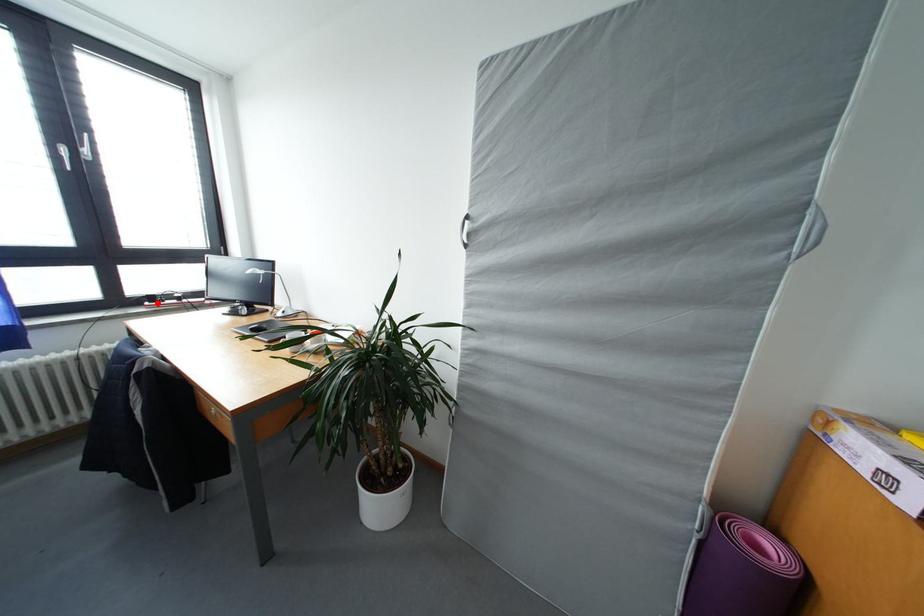
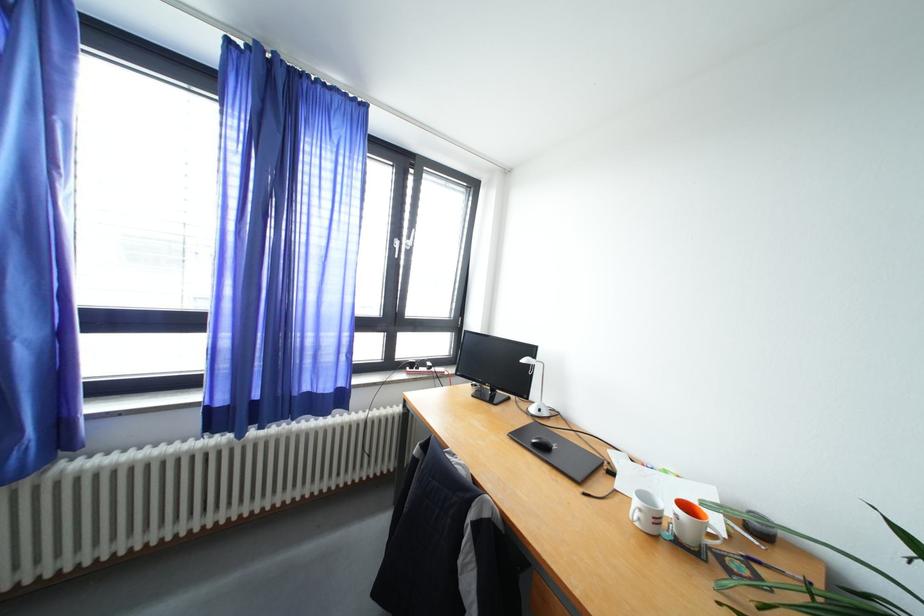
In the second image, find the point that corresponds to the highlighted location in the first image.

(419, 370)